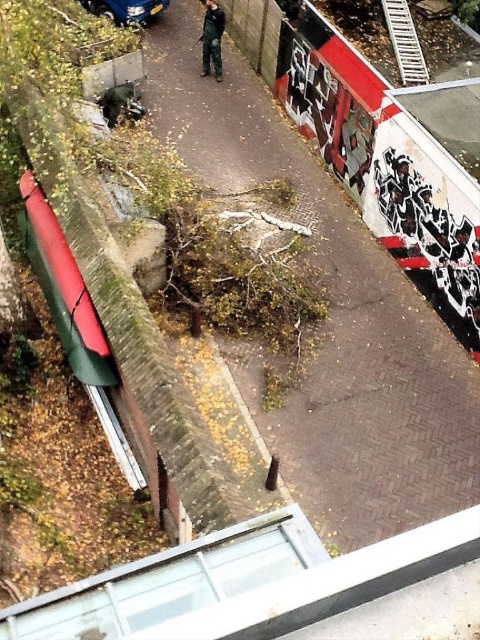
Question: Where is metallic blue car at upper left located in relation to dark green camouflage pants at center in the image?

Choices:
 (A) left
 (B) right

Answer: (A)

Question: Which of the following is the closest to the observer?

Choices:
 (A) (84, 3)
 (B) (216, 26)

Answer: (B)

Question: Is metallic blue car at upper left positioned before dark green camouflage pants at center?

Choices:
 (A) no
 (B) yes

Answer: (A)

Question: Can you confirm if metallic blue car at upper left is wider than dark green camouflage pants at center?

Choices:
 (A) no
 (B) yes

Answer: (B)

Question: Which object appears farthest from the camera in this image?

Choices:
 (A) dark green camouflage pants at center
 (B) metallic blue car at upper left

Answer: (B)

Question: Which point is farther to the camera?

Choices:
 (A) (123, 0)
 (B) (205, 4)

Answer: (B)